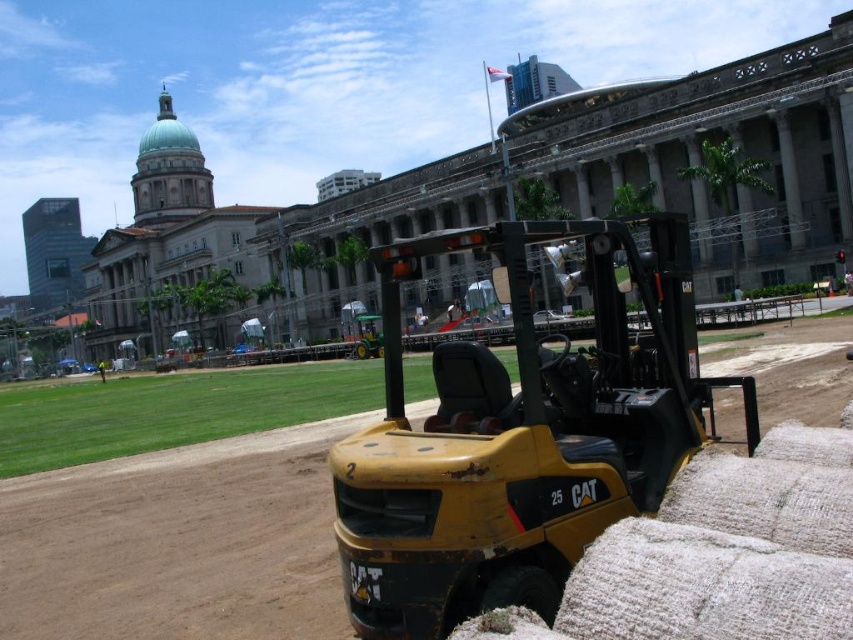
What are the coordinates of the yellow metallic excavator at center?

The yellow metallic excavator at center is located at coordinates point (520, 435).

You are a construction worker who needs to move heavy equipment from the yellow metallic excavator at center to the brown dirt track at center. Can you safely place the equipment on the track without it falling off?

The yellow metallic excavator at center is above the brown dirt track at center, so placing equipment from the excavator onto the track should be safe as long as the equipment is positioned correctly on the track.

You are standing at the point marked by the coordinates point (520, 435) in the image. What object are you standing on?

The point (520, 435) marks the yellow metallic excavator at center, so you are standing on the yellow metallic excavator at center.